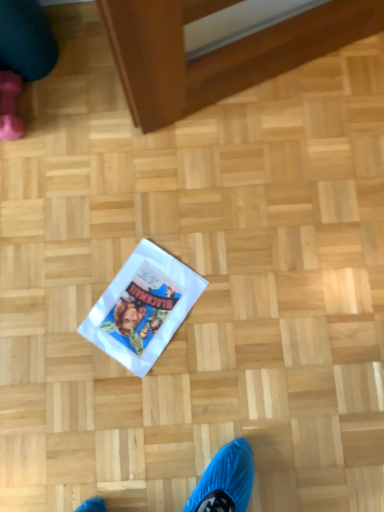
The image size is (384, 512). In order to click on vacant area that lies in front of white paper flyer at center in this screenshot , I will do `click(159, 397)`.